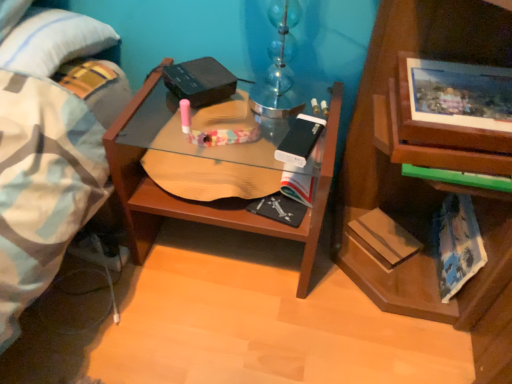
Question: Could you tell me if wooden desk at center is turned towards blue tie-dye paperback book at lower right, which appears as the 1th paperback book when viewed from the right?

Choices:
 (A) yes
 (B) no

Answer: (B)

Question: From the image's perspective, is wooden desk at center beneath blue tie-dye paperback book at lower right, which appears as the 1th paperback book when viewed from the right?

Choices:
 (A) yes
 (B) no

Answer: (B)

Question: From a real-world perspective, does wooden desk at center stand above blue tie-dye paperback book at lower right, which appears as the 1th paperback book when viewed from the right?

Choices:
 (A) no
 (B) yes

Answer: (B)

Question: Considering the relative positions of wooden desk at center and blue tie-dye paperback book at lower right, which appears as the third paperback book when viewed from the left, in the image provided, is wooden desk at center behind blue tie-dye paperback book at lower right, which appears as the third paperback book when viewed from the left,?

Choices:
 (A) yes
 (B) no

Answer: (B)

Question: Does wooden desk at center lie in front of blue tie-dye paperback book at lower right, which appears as the 1th paperback book when viewed from the right?

Choices:
 (A) no
 (B) yes

Answer: (B)

Question: Is wooden desk at center taller than blue tie-dye paperback book at lower right, which appears as the third paperback book when viewed from the left?

Choices:
 (A) no
 (B) yes

Answer: (B)

Question: Is white matte paperback book at center, acting as the 3th paperback book starting from the right, wider than hardcover book at lower right, which is the 2th paperback book in right-to-left order?

Choices:
 (A) yes
 (B) no

Answer: (A)

Question: Is white matte paperback book at center, the first paperback book viewed from the left, positioned with its back to hardcover book at lower right, which is the 2th paperback book in right-to-left order?

Choices:
 (A) yes
 (B) no

Answer: (B)

Question: Would you say white matte paperback book at center, the first paperback book viewed from the left, is outside hardcover book at lower right, which is the 2th paperback book in right-to-left order?

Choices:
 (A) no
 (B) yes

Answer: (B)

Question: Can you confirm if white matte paperback book at center, acting as the 3th paperback book starting from the right, is thinner than hardcover book at lower right, the second paperback book in the left-to-right sequence?

Choices:
 (A) yes
 (B) no

Answer: (B)

Question: Considering the relative positions of white matte paperback book at center, acting as the 3th paperback book starting from the right, and hardcover book at lower right, which is the 2th paperback book in right-to-left order, in the image provided, is white matte paperback book at center, acting as the 3th paperback book starting from the right, behind hardcover book at lower right, which is the 2th paperback book in right-to-left order,?

Choices:
 (A) yes
 (B) no

Answer: (B)

Question: From a real-world perspective, is white matte paperback book at center, the first paperback book viewed from the left, positioned under hardcover book at lower right, which is the 2th paperback book in right-to-left order, based on gravity?

Choices:
 (A) yes
 (B) no

Answer: (B)

Question: Does wooden desk at center have a larger size compared to hardcover book at lower right, the second paperback book in the left-to-right sequence?

Choices:
 (A) yes
 (B) no

Answer: (A)